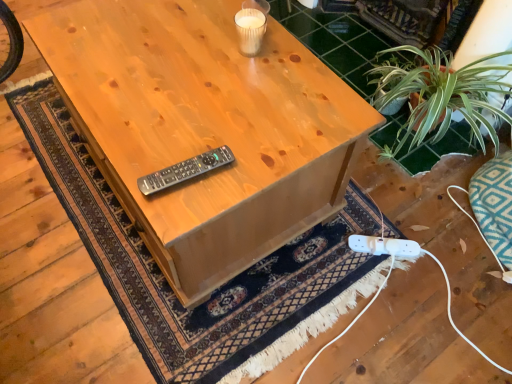
Where is `white plastic plug at lower right`? Image resolution: width=512 pixels, height=384 pixels. white plastic plug at lower right is located at coordinates pyautogui.click(x=384, y=246).

There is a natural wood table at center. At what (x,y) coordinates should I click in order to perform the action: click on control above it (from a real-world perspective). Please return your answer as a coordinate pair (x, y). Looking at the image, I should click on (185, 170).

Can you confirm if black plastic remote at center is wider than natural wood table at center?

No, black plastic remote at center is not wider than natural wood table at center.

Based on their sizes in the image, would you say black plastic remote at center is bigger or smaller than natural wood table at center?

Considering their sizes, black plastic remote at center takes up less space than natural wood table at center.

Between point (196, 174) and point (218, 120), which one is positioned behind?

Positioned behind is point (218, 120).

Based on the photo, considering the relative sizes of white plastic plug at lower right and natural wood table at center in the image provided, is white plastic plug at lower right bigger than natural wood table at center?

Incorrect, white plastic plug at lower right is not larger than natural wood table at center.

From the image's perspective, is white plastic plug at lower right located beneath natural wood table at center?

Yes, from the image's perspective, white plastic plug at lower right is beneath natural wood table at center.

I want to click on plug on the right side of natural wood table at center, so click(x=384, y=246).

Is white plastic plug at lower right behind natural wood table at center?

Yes, it is.

Considering the points (280, 65) and (351, 241), which point is in front, point (280, 65) or point (351, 241)?

The point (280, 65) is in front.

In the scene shown: Is natural wood table at center situated inside white plastic plug at lower right or outside?

natural wood table at center is not inside white plastic plug at lower right, it's outside.

Is natural wood table at center looking in the opposite direction of white plastic plug at lower right?

No, natural wood table at center's orientation is not away from white plastic plug at lower right.

From the image's perspective, which one is positioned lower, natural wood table at center or white plastic plug at lower right?

white plastic plug at lower right, from the image's perspective.

Can you tell me how much white plastic plug at lower right and black plastic remote at center differ in facing direction?

There is a 146-degree angle between the facing directions of white plastic plug at lower right and black plastic remote at center.

The width and height of the screenshot is (512, 384). I want to click on control above the white plastic plug at lower right (from a real-world perspective), so click(185, 170).

Can you confirm if white plastic plug at lower right is smaller than black plastic remote at center?

Incorrect, white plastic plug at lower right is not smaller in size than black plastic remote at center.

From a real-world perspective, is white plastic plug at lower right beneath black plastic remote at center?

Yes.

Would you say natural wood table at center is inside or outside black plastic remote at center?

natural wood table at center exists outside the volume of black plastic remote at center.

Between natural wood table at center and black plastic remote at center, which one appears on the right side from the viewer's perspective?

black plastic remote at center is more to the right.

Does natural wood table at center have a lesser height compared to black plastic remote at center?

No, natural wood table at center is not shorter than black plastic remote at center.

Would you consider natural wood table at center to be distant from black plastic remote at center?

That's not correct — natural wood table at center is a little close to black plastic remote at center.

From the image's perspective, is black plastic remote at center positioned above or below white plastic plug at lower right?

Clearly, from the image's perspective, black plastic remote at center is above white plastic plug at lower right.

Locate an element on the screen. The width and height of the screenshot is (512, 384). control lying above the white plastic plug at lower right (from the image's perspective) is located at coordinates (185, 170).

Can you confirm if black plastic remote at center is smaller than white plastic plug at lower right?

Correct, black plastic remote at center occupies less space than white plastic plug at lower right.

Is there a large distance between black plastic remote at center and white plastic plug at lower right?

They are positioned close to each other.

I want to click on table in front of the black plastic remote at center, so click(x=205, y=128).

This screenshot has width=512, height=384. Find the location of `table above the white plastic plug at lower right (from a real-world perspective)`. table above the white plastic plug at lower right (from a real-world perspective) is located at coordinates (205, 128).

Considering their positions, is white plastic plug at lower right positioned closer to natural wood table at center than black plastic remote at center?

black plastic remote at center is positioned closer to the anchor natural wood table at center.

Based on the photo, based on their spatial positions, is black plastic remote at center or white plastic plug at lower right closer to natural wood table at center?

Based on the image, black plastic remote at center appears to be nearer to natural wood table at center.

Considering their positions, is black plastic remote at center positioned closer to white plastic plug at lower right than natural wood table at center?

natural wood table at center is closer to white plastic plug at lower right.

Looking at the image, which one is located closer to black plastic remote at center, white plastic plug at lower right or natural wood table at center?

natural wood table at center is positioned closer to the anchor black plastic remote at center.

Which object lies nearer to the anchor point black plastic remote at center, natural wood table at center or white plastic plug at lower right?

natural wood table at center is closer to black plastic remote at center.

When comparing their distances from white plastic plug at lower right, does natural wood table at center or black plastic remote at center seem further?

The object further to white plastic plug at lower right is black plastic remote at center.

Locate an element on the screen. Image resolution: width=512 pixels, height=384 pixels. control situated between natural wood table at center and white plastic plug at lower right from left to right is located at coordinates (185, 170).